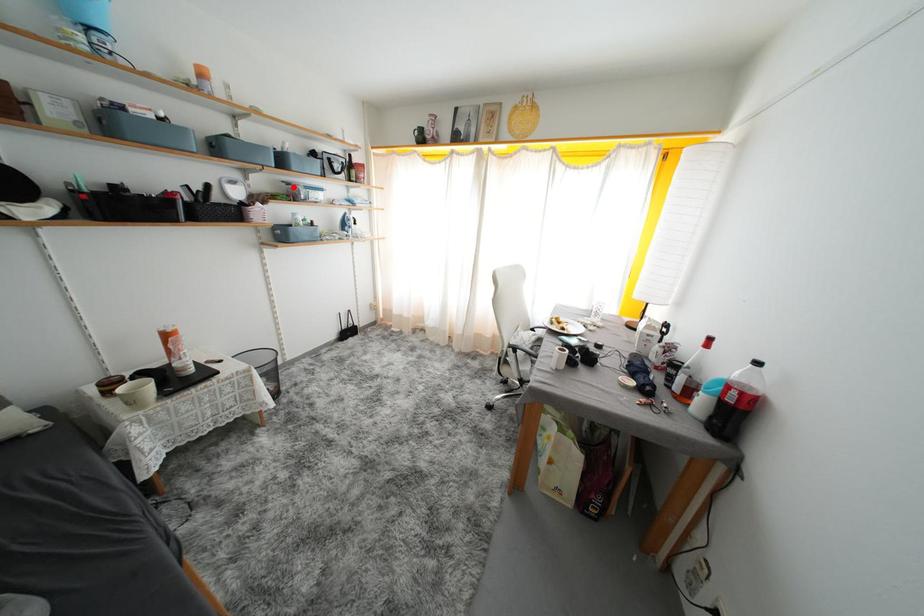
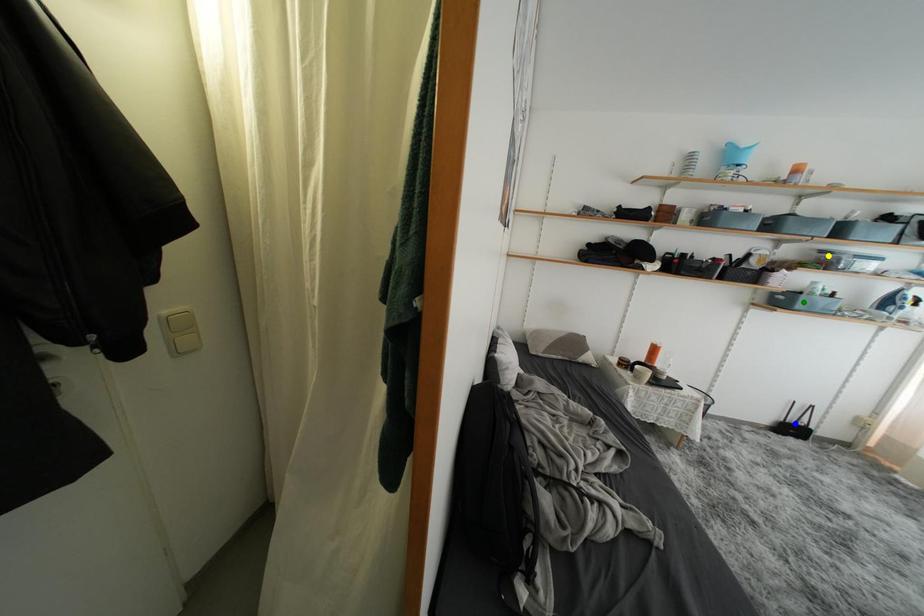
Question: I am providing you with two images of the same scene from different viewpoints. A red point is marked on the first image. You are given multiple points on the second image. Which point in image 2 represents the same 3d spot as the red point in image 1?

Choices:
 (A) green point
 (B) yellow point
 (C) blue point

Answer: (B)